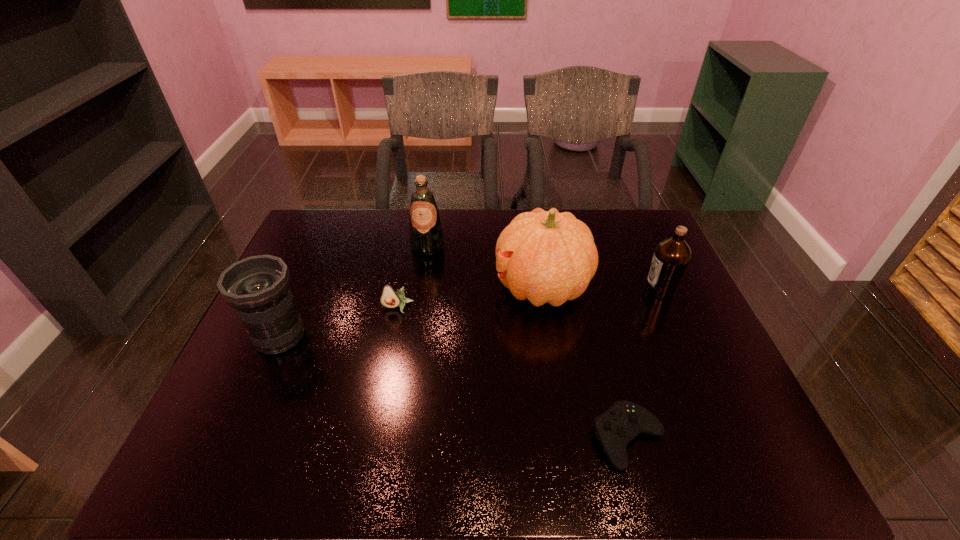
Find the location of `object present at the left edge`. object present at the left edge is located at coordinates (257, 287).

Find the location of a particular element. The height and width of the screenshot is (540, 960). object situated at the right edge is located at coordinates (671, 257).

In the image, there is a desktop. What are the coordinates of `free space at the far edge` in the screenshot? It's located at click(492, 247).

In the image, there is a desktop. Identify the location of vacant space at the near edge. (561, 476).

Locate an element on the screen. This screenshot has height=540, width=960. vacant point at the left edge is located at coordinates (272, 374).

In the image, there is a desktop. Identify the location of vacant space at the right edge. (719, 412).

This screenshot has width=960, height=540. Find the location of `vacant space at the far left corner`. vacant space at the far left corner is located at coordinates (344, 215).

At what (x,y) coordinates should I click in order to perform the action: click on blank space at the near right corner of the desktop. Please return your answer as a coordinate pair (x, y). The width and height of the screenshot is (960, 540). Looking at the image, I should click on (765, 460).

This screenshot has height=540, width=960. What are the coordinates of `free space between the avocado and the farther olive oil` in the screenshot? It's located at (413, 278).

Find the location of a particular element. free area in between the avocado and the pumpkin is located at coordinates (469, 298).